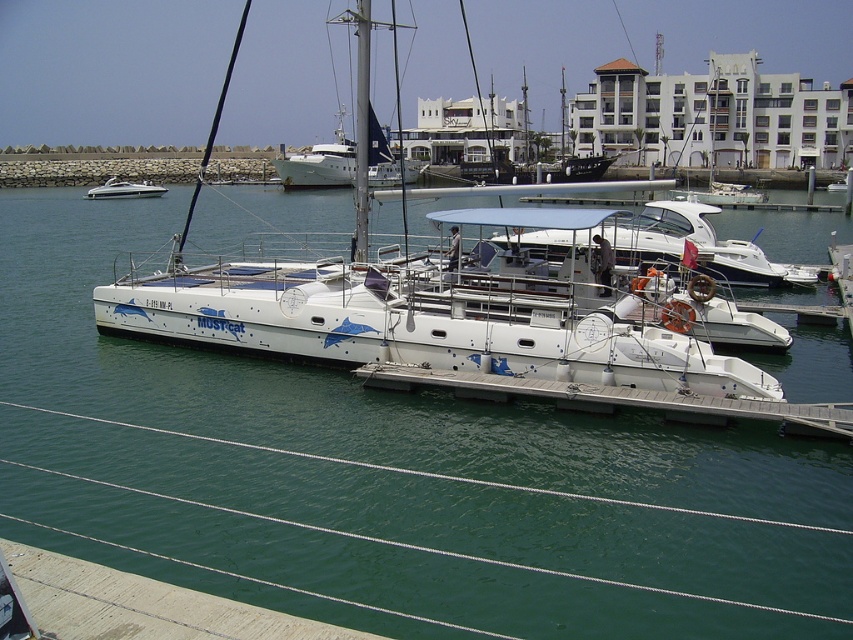
Does point (125, 250) lie in front of point (403, 282)?

No, (125, 250) is behind (403, 282).

Does white glossy water at center have a smaller size compared to white matte sailboat at center?

Yes.

This screenshot has height=640, width=853. Describe the element at coordinates (396, 440) in the screenshot. I see `white glossy water at center` at that location.

Find the location of a particular element. This screenshot has height=640, width=853. white glossy water at center is located at coordinates (396, 440).

Image resolution: width=853 pixels, height=640 pixels. Describe the element at coordinates (396, 440) in the screenshot. I see `white glossy water at center` at that location.

Measure the distance between point (206, 220) and camera.

The distance of point (206, 220) from camera is 139.75 feet.

The height and width of the screenshot is (640, 853). In order to click on white glossy water at center in this screenshot , I will do `click(396, 440)`.

Does white concrete dock at lower center have a lesser width compared to white glossy speedboat at left?

Yes, white concrete dock at lower center is thinner than white glossy speedboat at left.

Which is behind, point (561, 392) or point (109, 192)?

Point (109, 192)

Does point (664, 392) come farther from viewer compared to point (134, 188)?

No, (664, 392) is in front of (134, 188).

The width and height of the screenshot is (853, 640). Identify the location of white concrete dock at lower center. (616, 397).